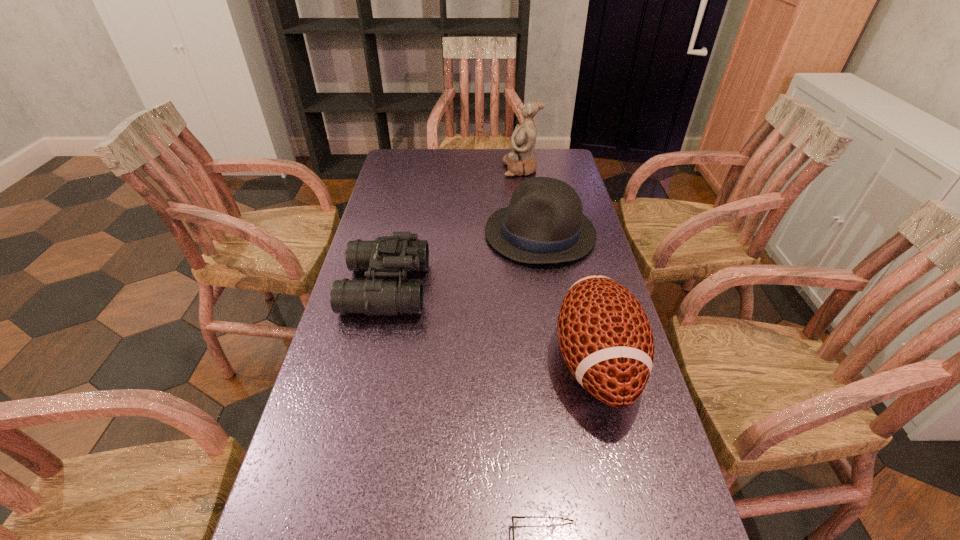
You are a GUI agent. You are given a task and a screenshot of the screen. Output one action in this format:
    pyautogui.click(x=<x>, y=<y>)
    Task: Click on the tallest object
    The width and height of the screenshot is (960, 540).
    Given the screenshot: What is the action you would take?
    pyautogui.click(x=521, y=160)

Where is `the farthest object`? the farthest object is located at coordinates (521, 160).

This screenshot has width=960, height=540. Identify the location of football. (605, 336).

At what (x,y) coordinates should I click in order to perform the action: click on bowler hat. Please return your answer as a coordinate pair (x, y). The width and height of the screenshot is (960, 540). Looking at the image, I should click on (544, 223).

I want to click on binoculars, so 392,256.

Find the location of a particular element. free space located 0.230m on the front-facing side of the farthest object is located at coordinates (444, 169).

The image size is (960, 540). In order to click on vacant region located on the front-facing side of the farthest object in this screenshot , I will do `click(485, 169)`.

The width and height of the screenshot is (960, 540). Identify the location of vacant space situated on the front-facing side of the farthest object. (419, 169).

Image resolution: width=960 pixels, height=540 pixels. I want to click on vacant region located on the left of the football, so click(x=473, y=362).

Image resolution: width=960 pixels, height=540 pixels. What are the coordinates of `vacant space located 0.200m on the front-facing side of the bowler hat` in the screenshot? It's located at (422, 233).